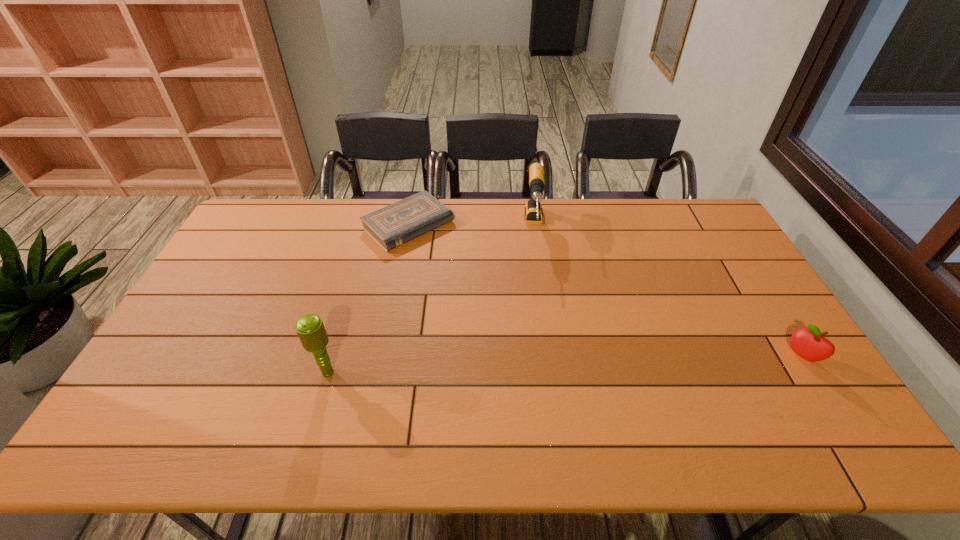
Where is `free point located on the spine side of the Bible`? The image size is (960, 540). free point located on the spine side of the Bible is located at coordinates (512, 313).

This screenshot has height=540, width=960. Identify the location of vacant space situated on the spine side of the Bible. (505, 307).

You are a GUI agent. You are given a task and a screenshot of the screen. Output one action in this format:
    pyautogui.click(x=<x>, y=<y>)
    Task: Click on the vacant region located on the spine side of the Bible
    The height and width of the screenshot is (540, 960).
    Given the screenshot: What is the action you would take?
    pyautogui.click(x=502, y=306)

Find the location of `drill that is at the far edge`. drill that is at the far edge is located at coordinates (533, 210).

Find the location of a particular element. This screenshot has height=540, width=960. Bible that is positioned at the far edge is located at coordinates (393, 225).

Identify the location of object that is positioned at the near edge. The image size is (960, 540). (310, 328).

At what (x,y) coordinates should I click in order to perform the action: click on object situated at the right edge. Please return your answer as a coordinate pair (x, y). The height and width of the screenshot is (540, 960). Looking at the image, I should click on (810, 344).

You are a GUI agent. You are given a task and a screenshot of the screen. Output one action in this format:
    pyautogui.click(x=<x>, y=<y>)
    Task: Click on the vacant space at the far edge of the desktop
    This screenshot has height=540, width=960.
    Given the screenshot: What is the action you would take?
    pyautogui.click(x=484, y=227)

Identify the location of free region at the near edge. The width and height of the screenshot is (960, 540). (245, 398).

At what (x,y) coordinates should I click in order to perform the action: click on vacant area at the left edge. Please return your answer as a coordinate pair (x, y). This screenshot has width=960, height=540. Looking at the image, I should click on (206, 323).